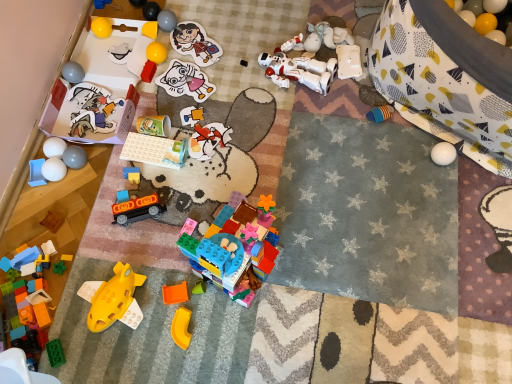
This screenshot has width=512, height=384. I want to click on free space to the back side of white matte balls at left, marked as the 4th toy in a left-to-right arrangement, so click(72, 122).